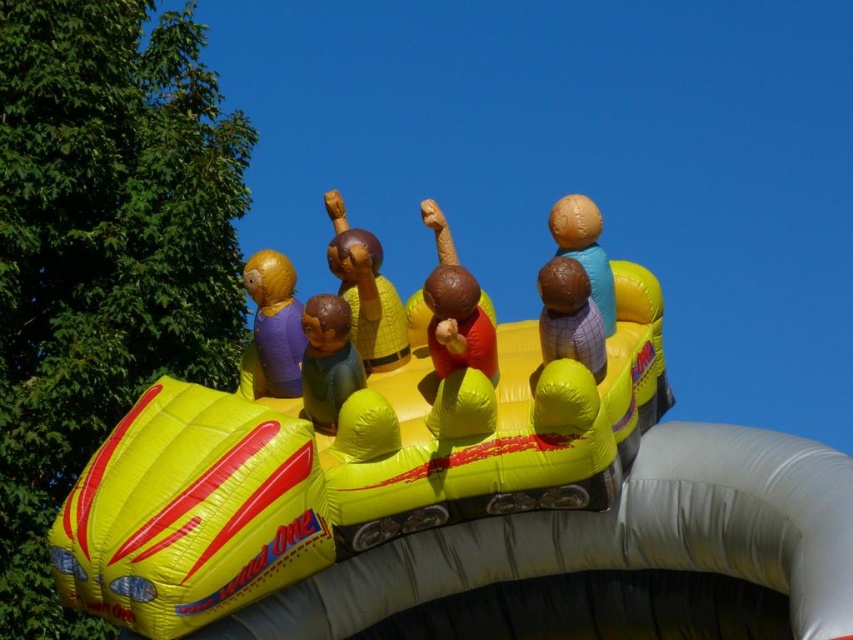
Can you confirm if matte yellow figure at center is positioned to the right of brown matte figure at center?

Incorrect, matte yellow figure at center is not on the right side of brown matte figure at center.

Can you confirm if matte yellow figure at center is shorter than brown matte figure at center?

No.

Between point (286, 381) and point (560, 307), which one is positioned behind?

The point (286, 381) is behind.

Identify the location of matte yellow figure at center. The image size is (853, 640). (271, 328).

Is matte yellow figure at center shorter than matte brown figure at center?

No, matte yellow figure at center is not shorter than matte brown figure at center.

In order to click on matte yellow figure at center in this screenshot , I will do `click(271, 328)`.

Between point (279, 323) and point (318, 376), which one is positioned behind?

Point (279, 323)

Locate an element on the screen. matte yellow figure at center is located at coordinates (271, 328).

Is brown matte figure at center wider than matte brown ball at center?

In fact, brown matte figure at center might be narrower than matte brown ball at center.

Which is above, brown matte figure at center or matte brown ball at center?

Positioned higher is matte brown ball at center.

I want to click on brown matte figure at center, so click(570, 316).